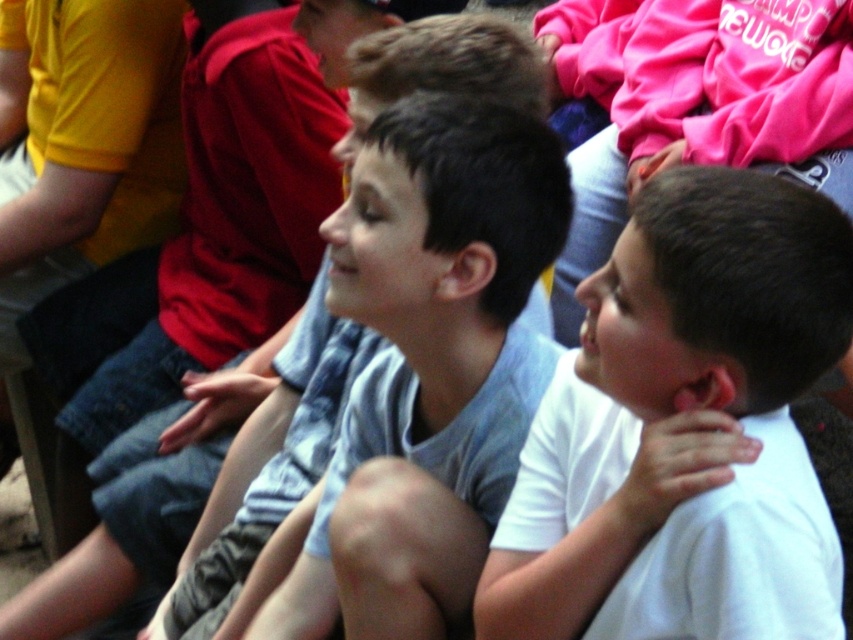
Does white matte shirt at center lie behind gray cotton shirt at center?

That is False.

Locate an element on the screen. The image size is (853, 640). white matte shirt at center is located at coordinates (677, 412).